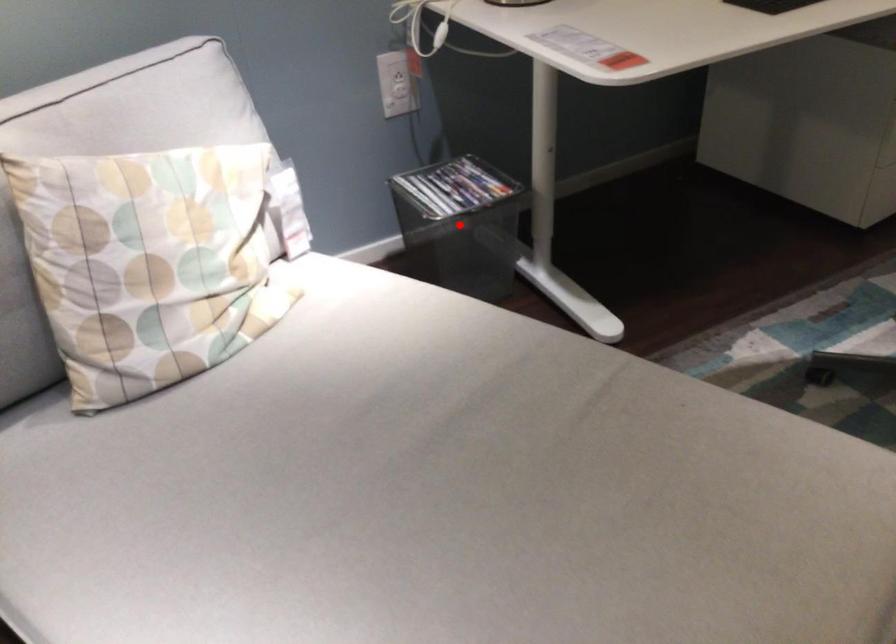
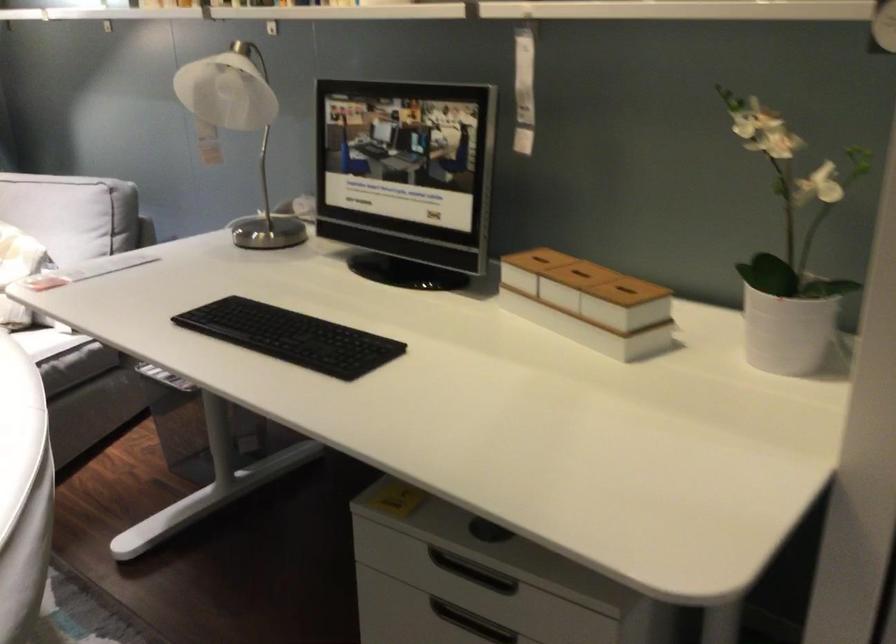
Question: I am providing you with two images of the same scene from different viewpoints. A red point is marked on the first image. At the location where the point appears in image 1, is it still visible in image 2?

Choices:
 (A) Yes
 (B) No

Answer: (B)